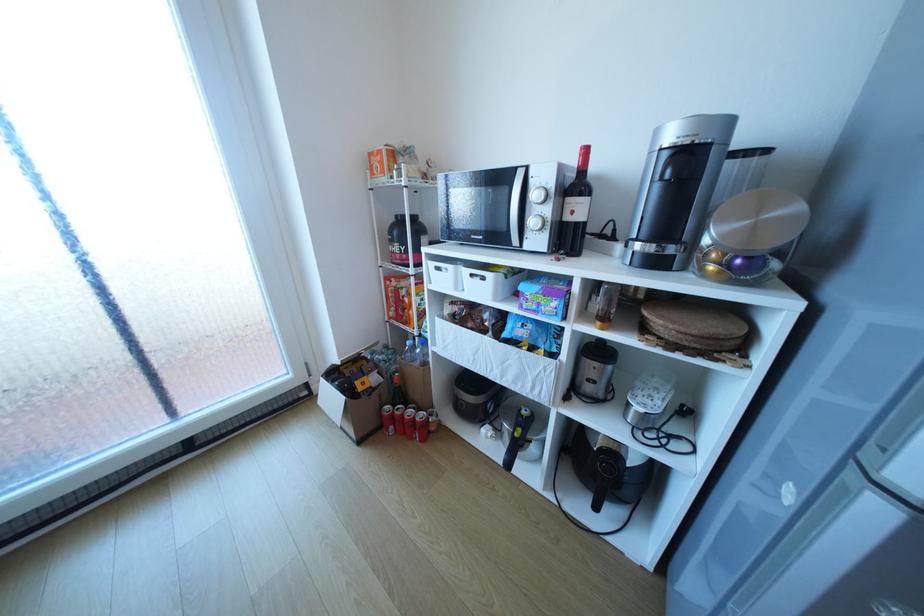
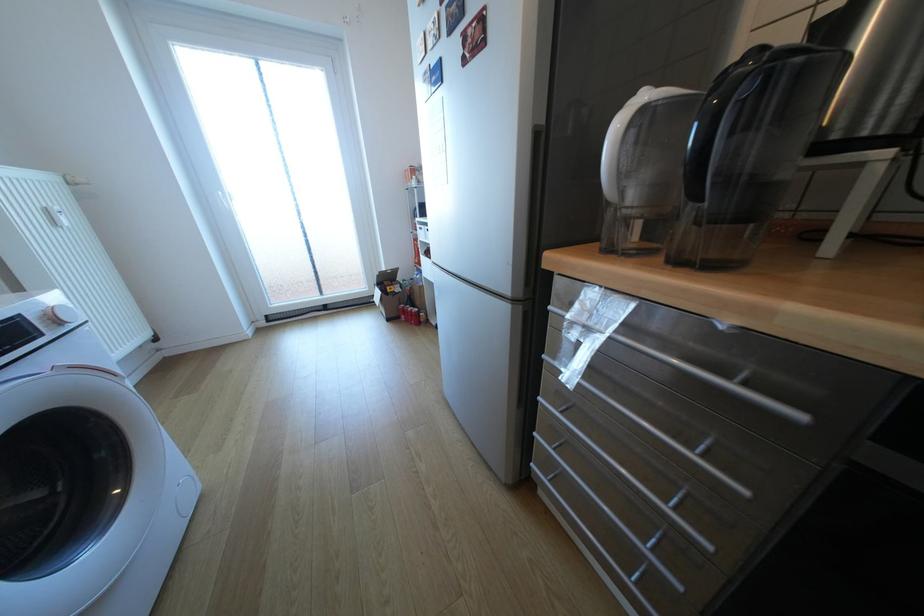
Where in the second image is the point corresponding to point 400,428 from the first image?

(411, 315)